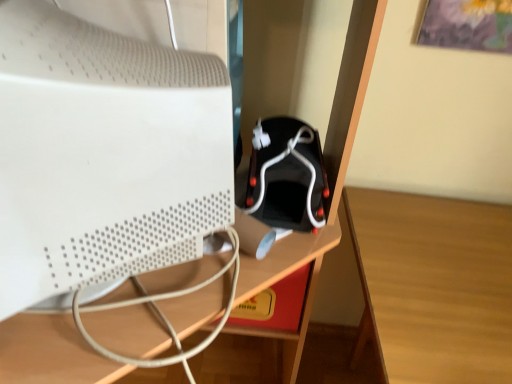
Question: Should I look upward or downward to see black matte speaker at center?

Choices:
 (A) down
 (B) up

Answer: (B)